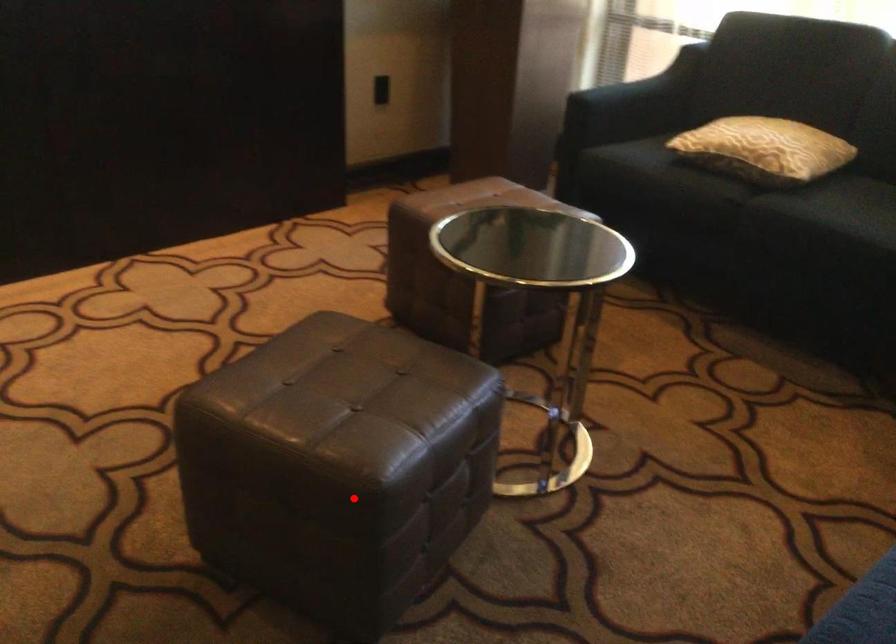
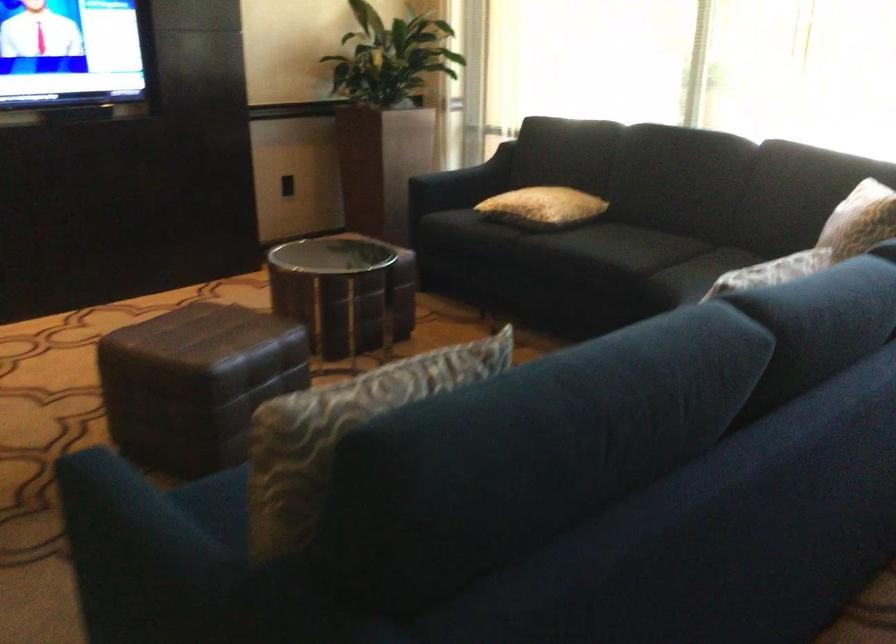
In the second image, find the point that corresponds to the highlighted location in the first image.

(195, 383)